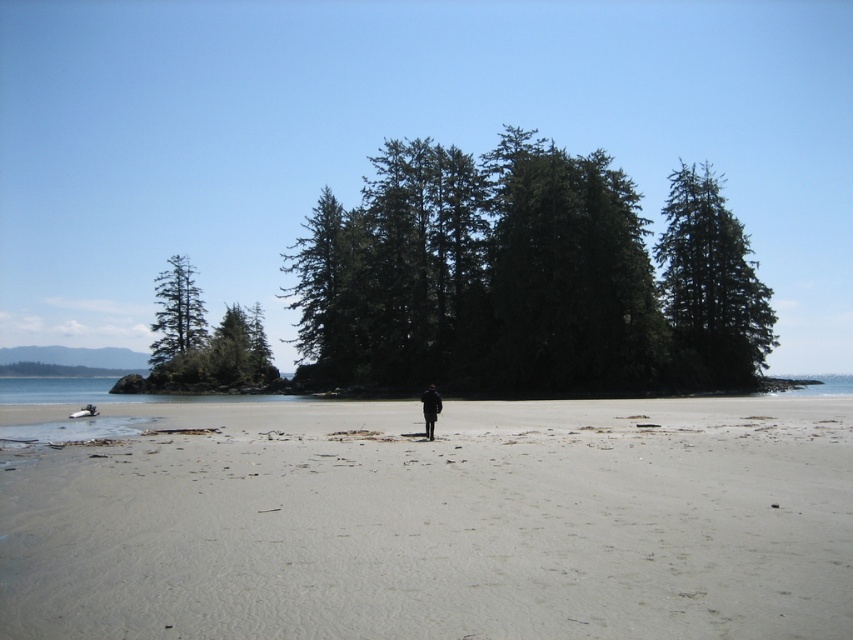
Question: Is light beige sand at center wider than green matte trees at center?

Choices:
 (A) no
 (B) yes

Answer: (A)

Question: Is green matte trees at center wider than green textured tree at upper right?

Choices:
 (A) no
 (B) yes

Answer: (B)

Question: Estimate the real-world distances between objects in this image. Which object is farther from the green textured tree at upper right?

Choices:
 (A) green matte trees at center
 (B) green matte tree at left
 (C) black matte jacket at center
 (D) light beige sand at center

Answer: (B)

Question: Which point is farther to the camera?

Choices:
 (A) (683, 512)
 (B) (422, 397)
 (C) (195, 348)

Answer: (C)

Question: Does light beige sand at center have a smaller size compared to black matte jacket at center?

Choices:
 (A) yes
 (B) no

Answer: (B)

Question: Which point is closer to the camera?

Choices:
 (A) (682, 180)
 (B) (158, 346)

Answer: (A)